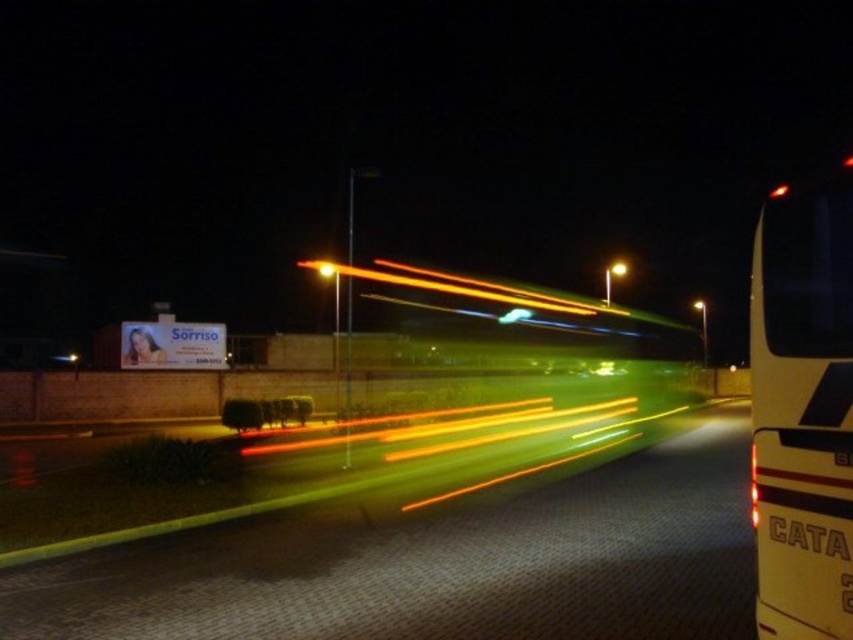
What is the exact coordinate of the yellow light trails at center?

The yellow light trails at center are located at point (436, 563).